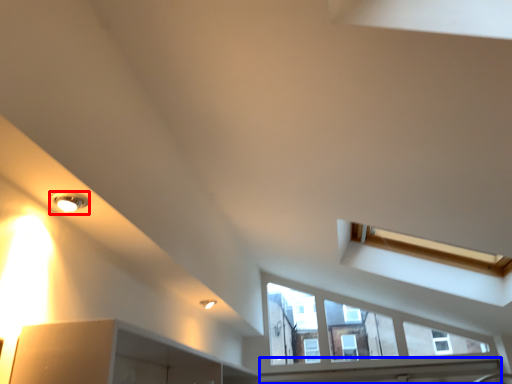
Question: Which object is further to the camera taking this photo, light fixture (highlighted by a red box) or window sill (highlighted by a blue box)?

Choices:
 (A) light fixture
 (B) window sill

Answer: (B)